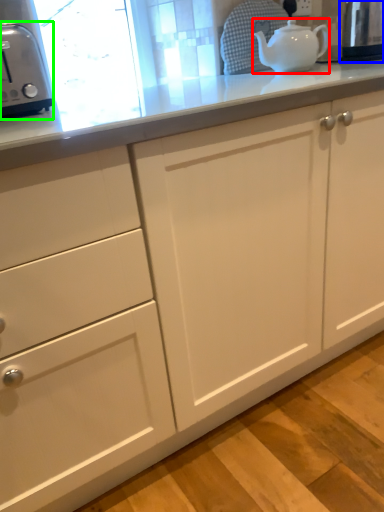
Question: Which is nearer to the teapot (highlighted by a red box)? appliance (highlighted by a blue box) or toaster (highlighted by a green box).

Choices:
 (A) appliance
 (B) toaster

Answer: (A)